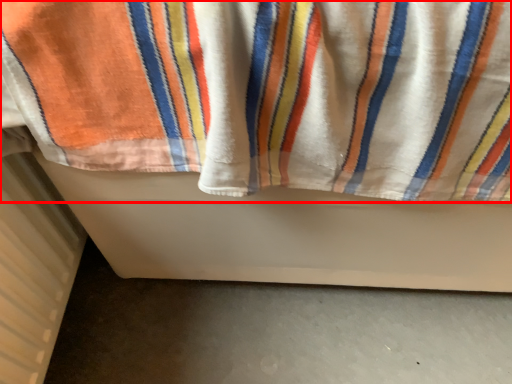
Question: In this image, where is towel (annotated by the red box) located relative to radiator?

Choices:
 (A) left
 (B) right

Answer: (B)